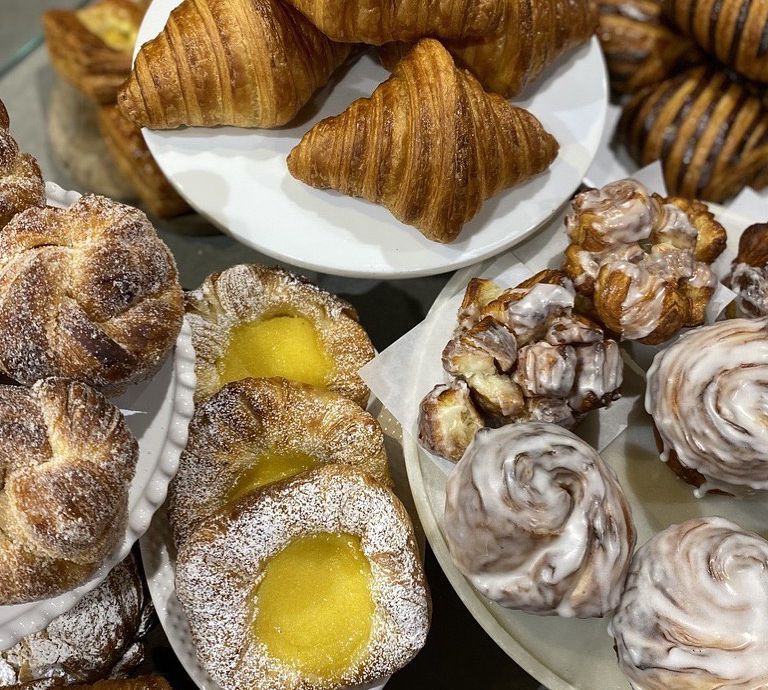
The height and width of the screenshot is (690, 768). Identify the location of plate. coord(641,457).